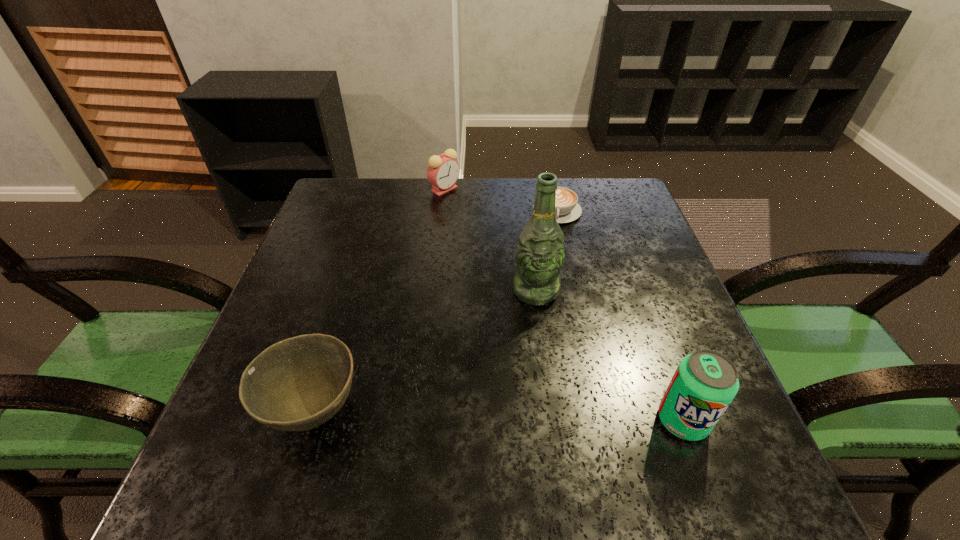
Identify the location of vacant space in between the rightmost object and the farthest object. (564, 305).

I want to click on free spot between the alarm clock and the leftmost object, so click(379, 300).

Select which object is the fourth closest to the leftmost object. Please provide its 2D coordinates. Your answer should be formatted as a tuple, i.e. [(x, y)], where the tuple contains the x and y coordinates of a point satisfying the conditions above.

[(443, 171)]

Identify which object is the fourth closest to the beer bottle. Please provide its 2D coordinates. Your answer should be formatted as a tuple, i.e. [(x, y)], where the tuple contains the x and y coordinates of a point satisfying the conditions above.

[(443, 171)]

Where is `vacant space that satisfies the following two spatial constraints: 1. on the back side of the leftmost object; 2. on the left side of the fourth nearest object`? Image resolution: width=960 pixels, height=540 pixels. vacant space that satisfies the following two spatial constraints: 1. on the back side of the leftmost object; 2. on the left side of the fourth nearest object is located at coordinates (374, 212).